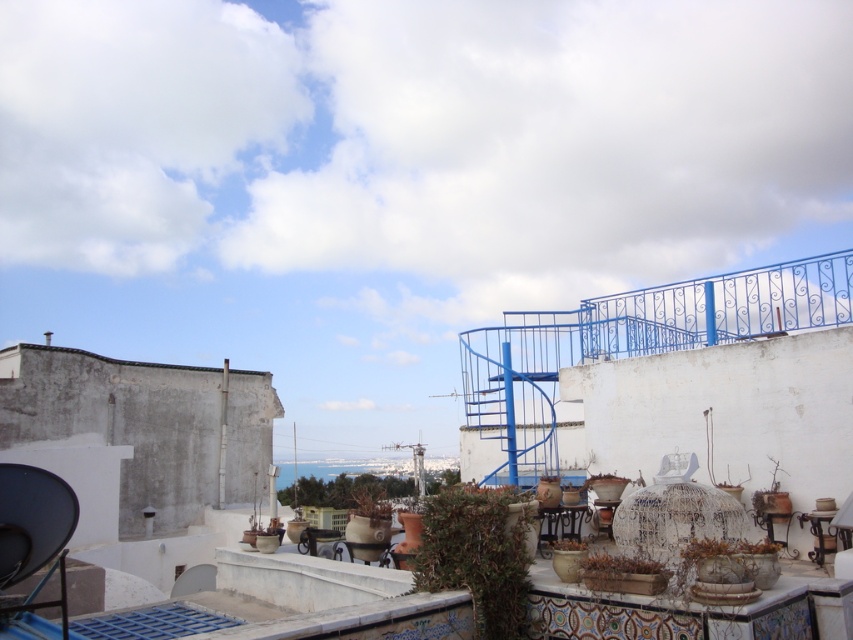
You are a delivery drone carrying a package that requires a landing spot on the rooftop. The brown wooden planter at center and the green matte plant at lower right are in your path. Can you safely land between them if your drone has a wingspan of 12 feet?

The distance between the brown wooden planter at center and the green matte plant at lower right is 13.54 feet. Since the drone has a wingspan of 12 feet, there is enough space to land safely between them.

You are standing on the rooftop and want to water both the green matte plant at center and the green matte plant at lower right. If your watering can has a range of 4 meters, can you water both plants without moving closer?

The green matte plant at center is 4.31 meters away from the green matte plant at lower right. Since the watering can only reaches 4 meters, you cannot water both plants without moving closer because the distance between them exceeds the can range.

You are standing on the rooftop and want to water both the green matte plant at center and the brown wooden planter at center. Which one should you water first if you want to start with the one closer to you?

You should water the green matte plant at center first because it is closer to you than the brown wooden planter at center.